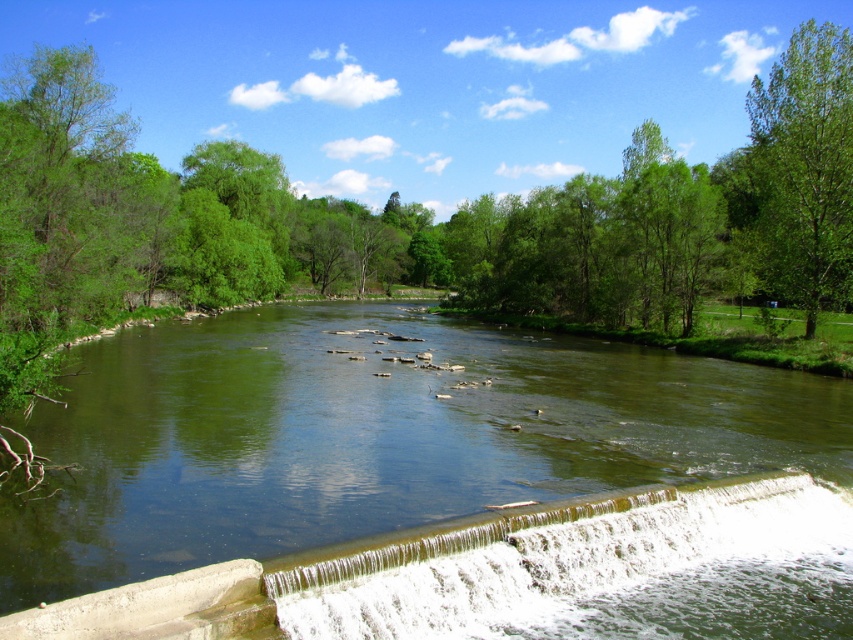
You are standing at the edge of the river and want to cross it using a small wooden plank. The green smooth river at center and the white frothy water at lower center are in your path. Which part of the river should you avoid stepping on to ensure stability?

You should avoid stepping on the white frothy water at lower center because the green smooth river at center has a greater height, indicating calmer and more stable water for crossing.

You are planning to cross the river using a small boat. You need to choose between two paths. One is the green smooth river at center and the other is the white frothy water at lower center. Which path is wider and safer for your boat?

The green smooth river at center is wider than the white frothy water at lower center, so it is safer for your boat.

You are standing on the bank of the green smooth river at center and looking towards the green leafy tree at upper right. Which object appears taller from your perspective?

The green leafy tree at upper right appears taller than the green smooth river at center because the river is not as tall as the tree.